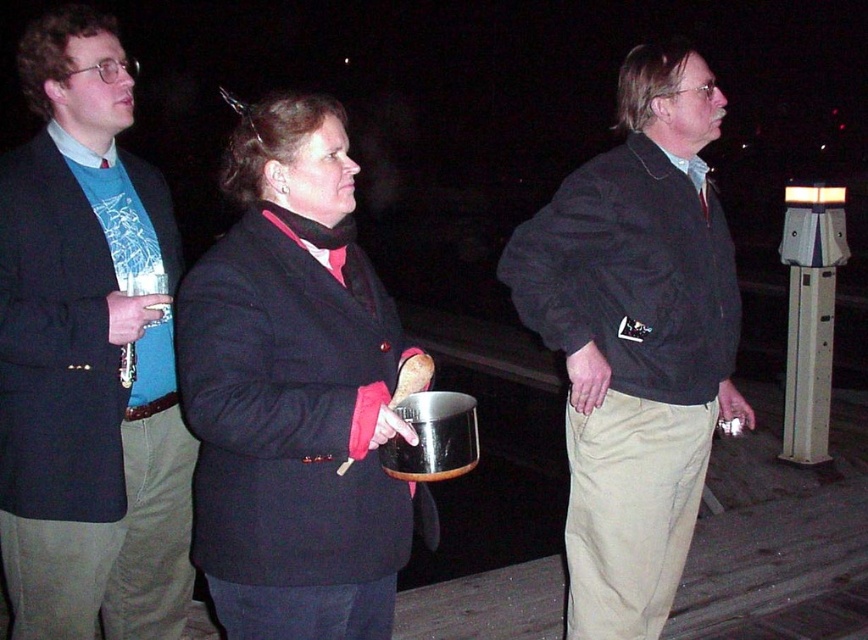
In the scene shown: Based on the scene description, can you determine if the matte black coat at center is positioned higher than the khaki pants at center?

Yes, the matte black coat at center is located above khaki pants at center, so it is positioned higher.

You are a photographer trying to capture the scene with a camera that has a 10cm focal length. You want to ensure both the brushed metal flute at left and the khaki pants at center are in focus. Given their sizes, which object should you focus on first to maximize clarity?

The brushed metal flute at left is smaller than the khaki pants at center, so focusing on the khaki pants at center first would help ensure both are in focus since it is larger and requires less precise focusing.